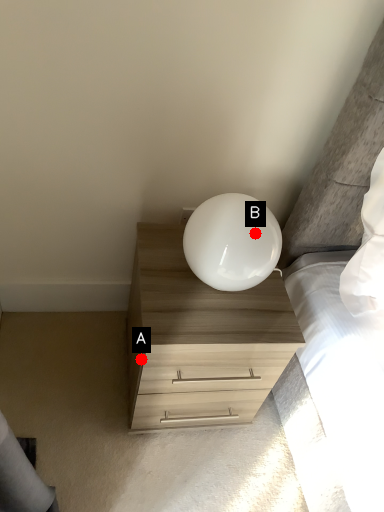
Question: Two points are circled on the image, labeled by A and B beside each circle. Which point is closer to the camera?

Choices:
 (A) A is closer
 (B) B is closer

Answer: (B)